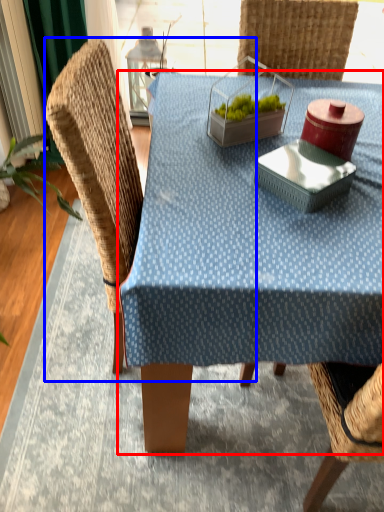
Question: Which point is further to the camera, table (highlighted by a red box) or swivel chair (highlighted by a blue box)?

Choices:
 (A) table
 (B) swivel chair

Answer: (B)